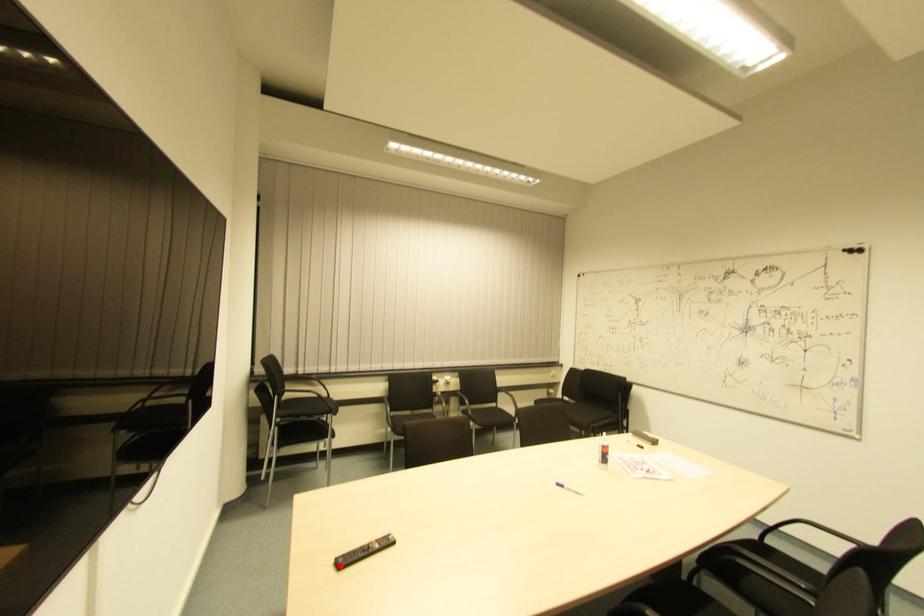
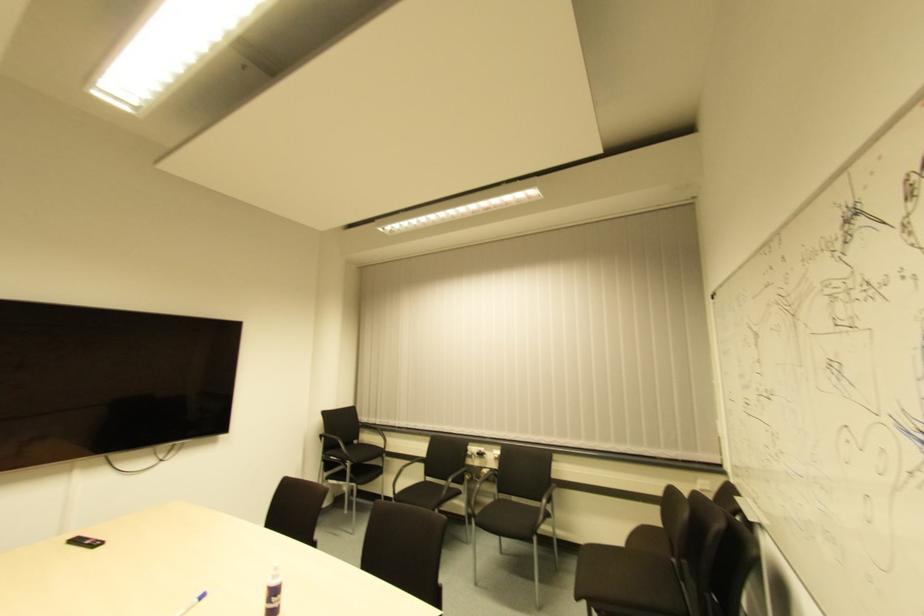
Locate, in the second image, the point that corresponds to the highlighted location in the first image.

(73, 543)